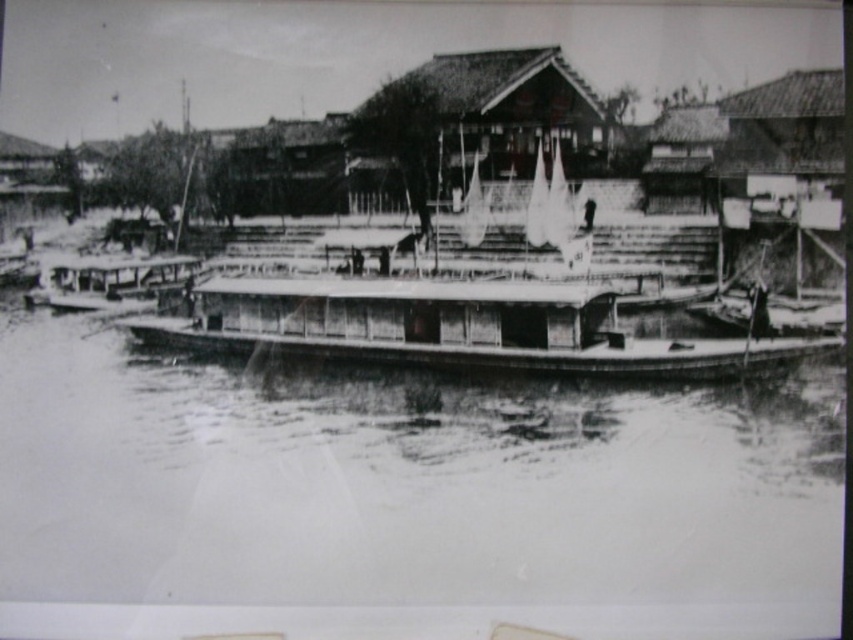
Question: Which object appears farthest from the camera in this image?

Choices:
 (A) wooden boat at center
 (B) smooth wooden boat at center

Answer: (A)

Question: Is smooth wooden boat at center to the right of wooden boat at center from the viewer's perspective?

Choices:
 (A) no
 (B) yes

Answer: (A)

Question: Which of the following is the closest to the observer?

Choices:
 (A) (779, 364)
 (B) (90, 541)

Answer: (B)

Question: Does smooth wooden boat at center appear over wooden boat at center?

Choices:
 (A) no
 (B) yes

Answer: (A)

Question: Among these objects, which one is nearest to the camera?

Choices:
 (A) smooth wooden boat at center
 (B) wooden boat at center

Answer: (A)

Question: Is smooth wooden boat at center positioned before wooden boat at center?

Choices:
 (A) yes
 (B) no

Answer: (A)